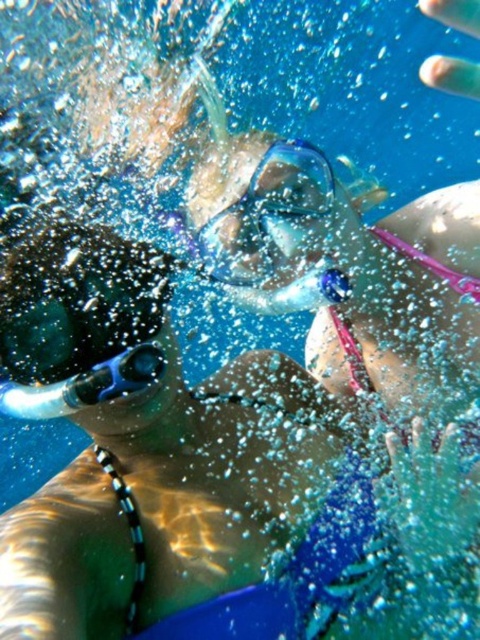
Question: Which of the following is the farthest from the observer?

Choices:
 (A) [156, 353]
 (B) [255, 260]

Answer: (B)

Question: Can you confirm if transparent plastic goggles at center is thinner than blue rubber snorkel at lower left?

Choices:
 (A) yes
 (B) no

Answer: (B)

Question: Is transparent plastic goggles at center thinner than blue rubber snorkel at lower left?

Choices:
 (A) no
 (B) yes

Answer: (A)

Question: Does transparent plastic goggles at center lie in front of blue rubber snorkel at lower left?

Choices:
 (A) no
 (B) yes

Answer: (A)

Question: Which point is farther to the camera?

Choices:
 (A) transparent plastic goggles at center
 (B) blue rubber snorkel at lower left

Answer: (A)